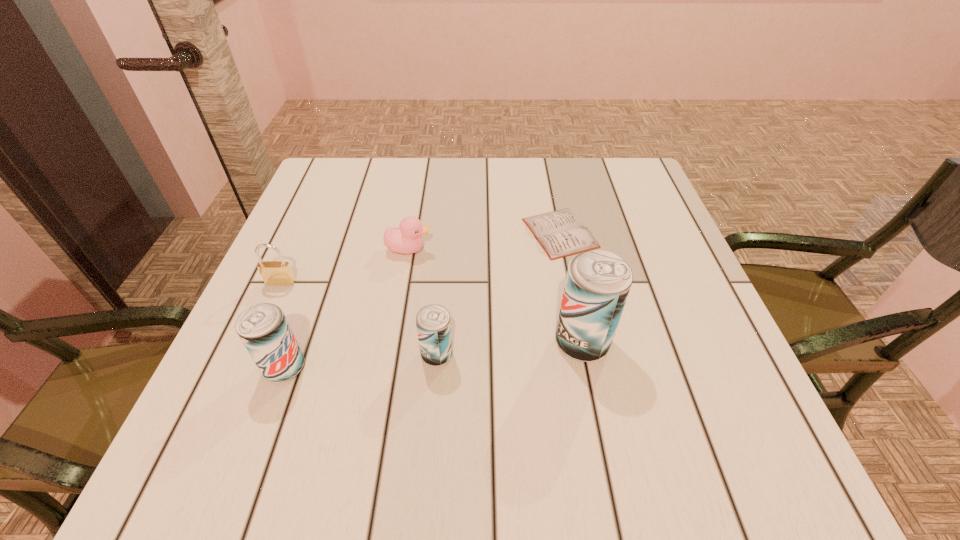
Please point a free position for a beer can on the right. Please provide its 2D coordinates. Your answer should be formatted as a tuple, i.e. [(x, y)], where the tuple contains the x and y coordinates of a point satisfying the conditions above.

[(721, 331)]